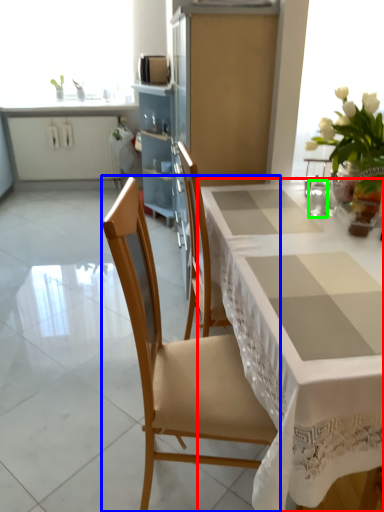
Question: Based on their relative distances, which object is farther from table (highlighted by a red box)? Choose from chair (highlighted by a blue box) and tableware (highlighted by a green box).

Choices:
 (A) chair
 (B) tableware

Answer: (B)